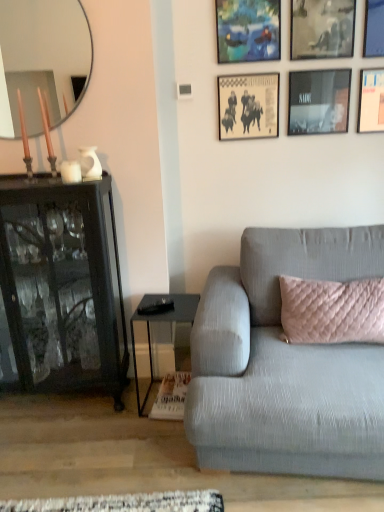
The height and width of the screenshot is (512, 384). Find the location of `vacant space positioned to the left of metallic glass table at lower center`. vacant space positioned to the left of metallic glass table at lower center is located at coordinates pyautogui.click(x=119, y=407).